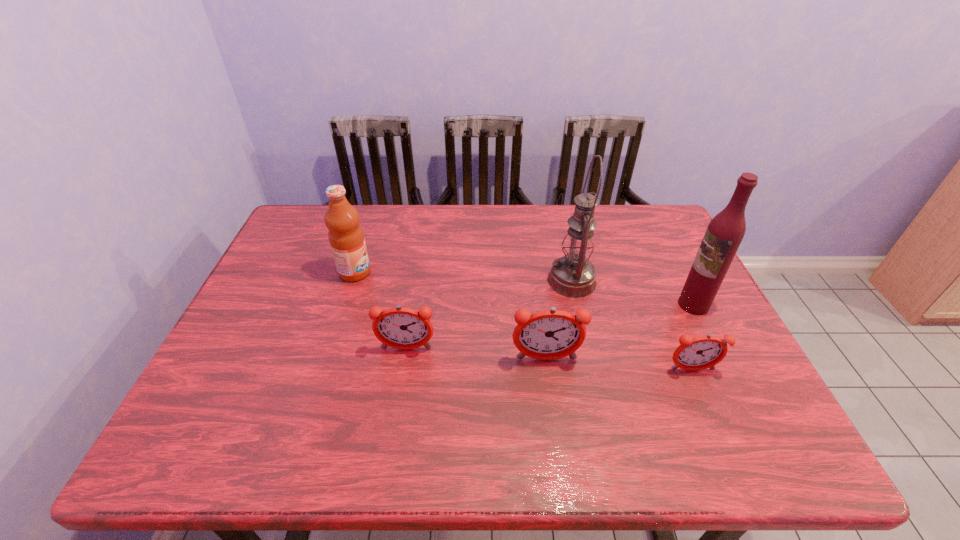
You are a GUI agent. You are given a task and a screenshot of the screen. Output one action in this format:
    pyautogui.click(x=<x>, y=<y>)
    Task: Click on the free point that keeps the alarm clocks evenly spaced on the left
    This screenshot has height=540, width=960.
    Given the screenshot: What is the action you would take?
    pyautogui.click(x=273, y=339)